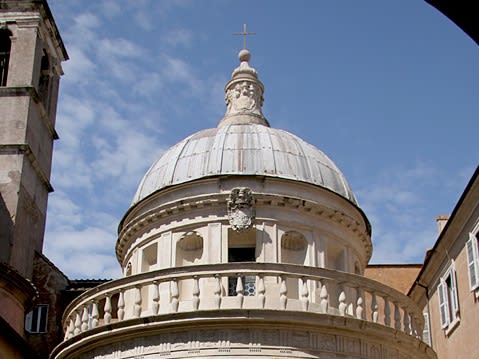
You are a GUI agent. You are given a task and a screenshot of the screen. Output one action in this format:
    pyautogui.click(x=<x>, y=<y>)
    Task: Click on the window shutters
    
    Given the screenshot: What is the action you would take?
    pyautogui.click(x=471, y=254), pyautogui.click(x=425, y=330), pyautogui.click(x=441, y=300), pyautogui.click(x=455, y=288), pyautogui.click(x=28, y=325)